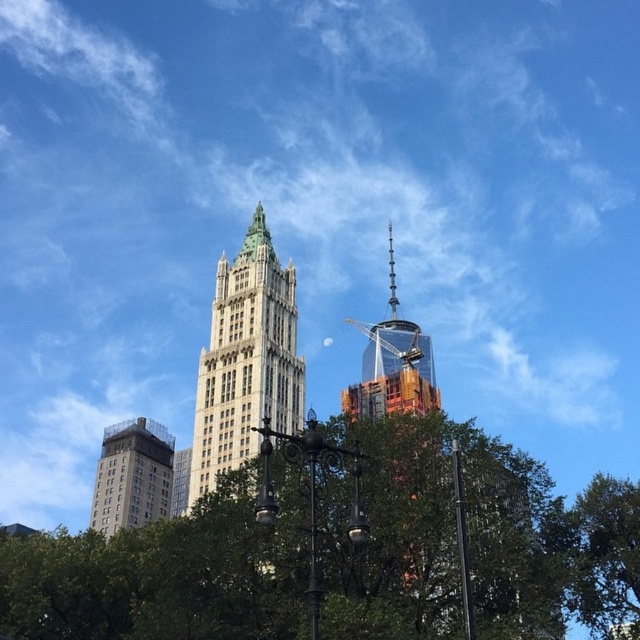
You are a city planner reviewing a map of the city. You see a point marked at coordinates (246, 360). According to the map, what does this point indicate?

The point at coordinates (246, 360) marks the white stone tower at center.